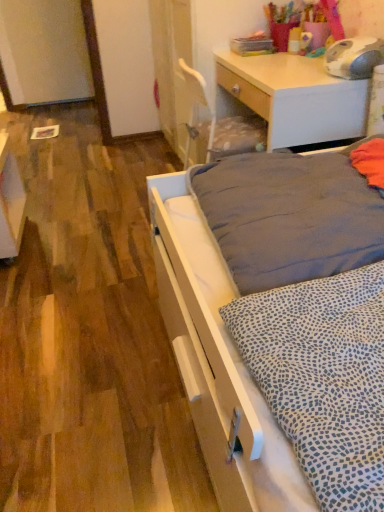
Image resolution: width=384 pixels, height=512 pixels. What are the coordinates of `free space above light wood desk at upper right (from a real-world perspective)` in the screenshot? It's located at (272, 64).